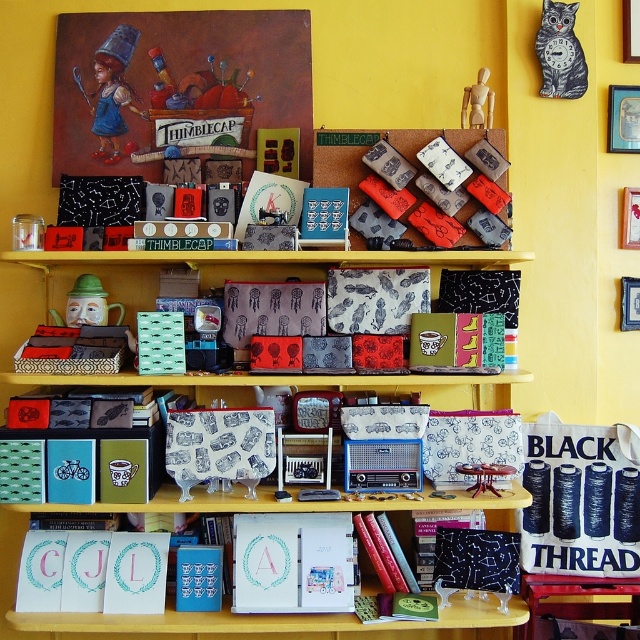
Question: Based on their relative distances, which object is farther from the patterned fabric boxes at center?

Choices:
 (A) wooden picture frame at upper center
 (B) wooden picture frame at upper right
 (C) matte black boxes at center

Answer: (B)

Question: Is patterned fabric boxes at center to the right of metallic silver picture frame at upper right from the viewer's perspective?

Choices:
 (A) no
 (B) yes

Answer: (A)

Question: Among these points, which one is nearest to the camera?

Choices:
 (A) pos(625,308)
 (B) pos(609,104)
 (C) pos(64,275)

Answer: (C)

Question: Is the position of matte black boxes at center more distant than that of metallic silver picture frame at upper right?

Choices:
 (A) no
 (B) yes

Answer: (A)

Question: Is patterned fabric boxes at center bigger than wooden picture frame at upper right?

Choices:
 (A) yes
 (B) no

Answer: (A)

Question: Which object is closer to the camera taking this photo?

Choices:
 (A) matte black boxes at center
 (B) metallic silver picture frame at upper right
 (C) wooden picture frame at upper center

Answer: (A)